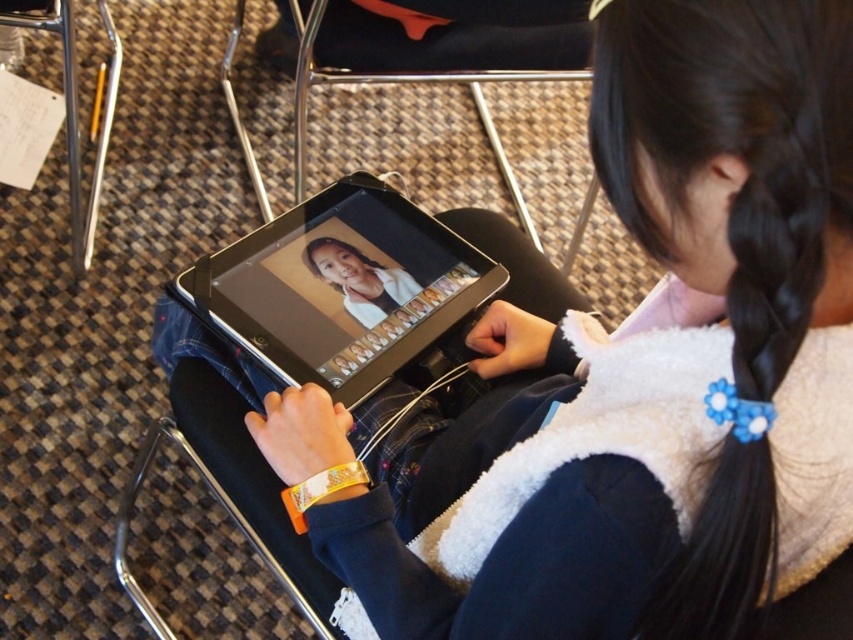
You are organizing a classroom and need to place the black glossy tablet at center and the black plastic chair at center in a small corner. Considering their sizes, which object should you place first to maximize space efficiency?

The black glossy tablet at center occupies less space than the black plastic chair at center, so you should place the black plastic chair at center first to leave more room for the smaller tablet.

You are a teacher observing a classroom scene. You notice the white fleece vest at center and the black glossy tablet at center. Which object is located below the other?

The white fleece vest at center is positioned under the black glossy tablet at center, meaning the vest is below the tablet.

You are a teacher observing a classroom scene. You notice a black glossy tablet at center located at point (340, 288). If you were to walk directly towards this point from the front of the classroom, would you collide with any objects before reaching it?

The black glossy tablet at center is located at point (340, 288). Since there are no other objects mentioned in the scene description between your starting position at the front of the classroom and this point, you would not collide with any objects before reaching it.